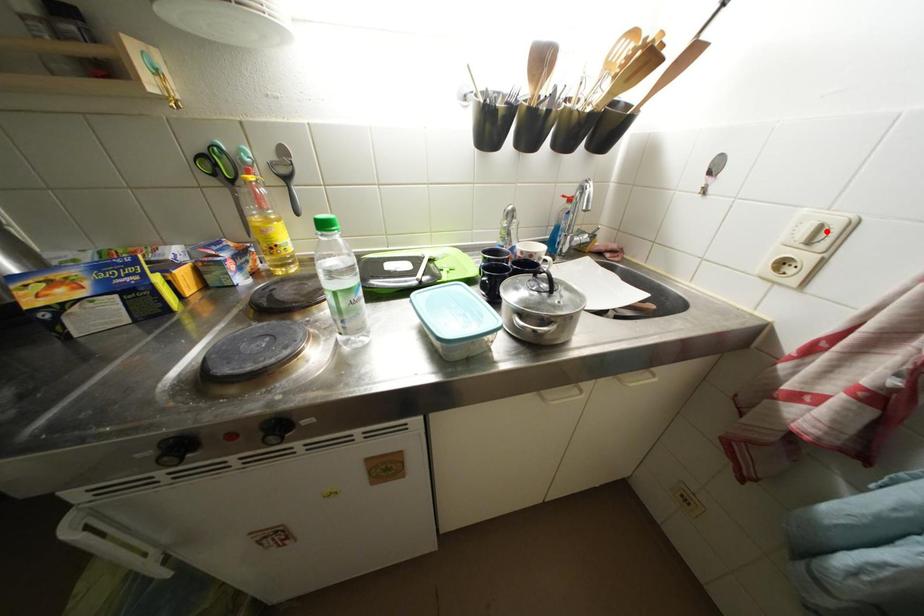
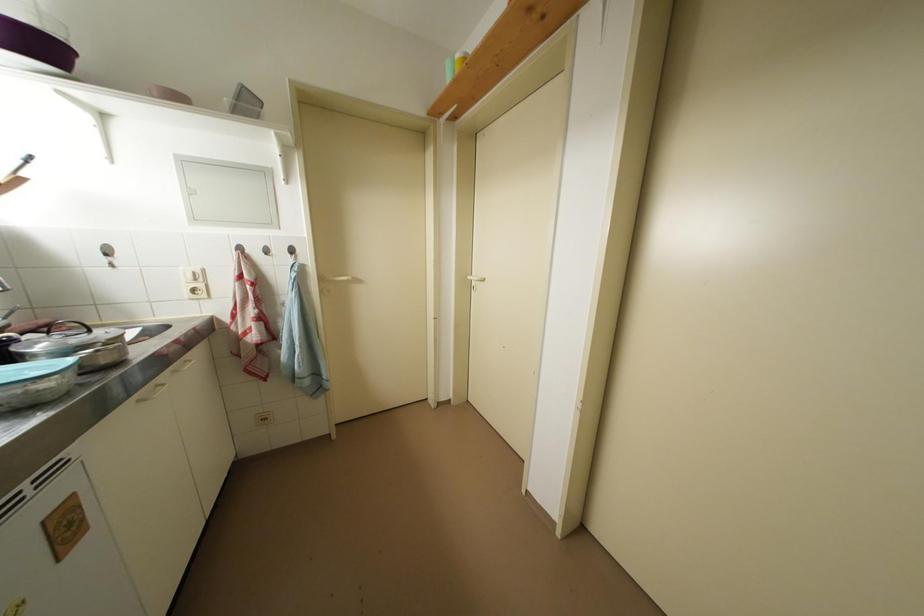
The point at the highlighted location is marked in the first image. Where is the corresponding point in the second image?

(201, 277)